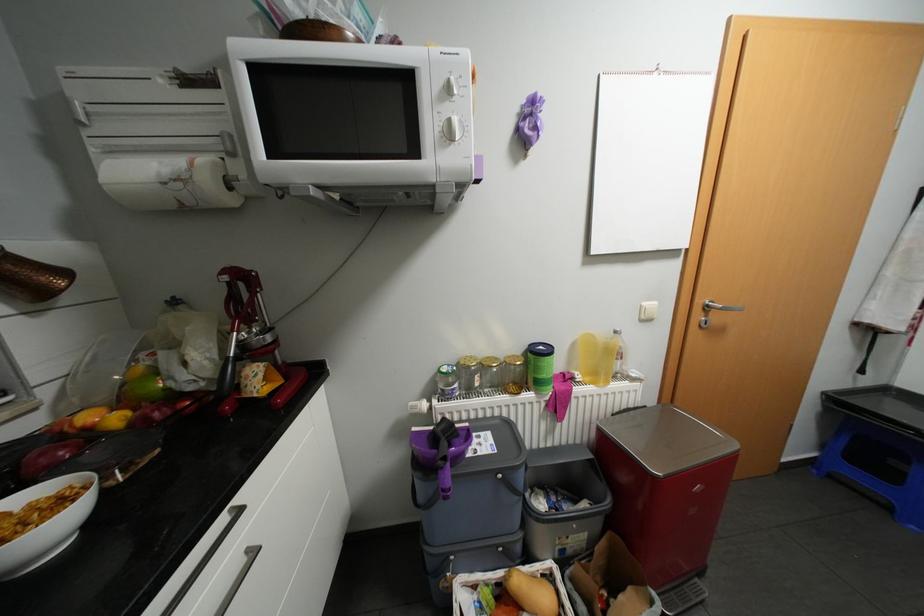
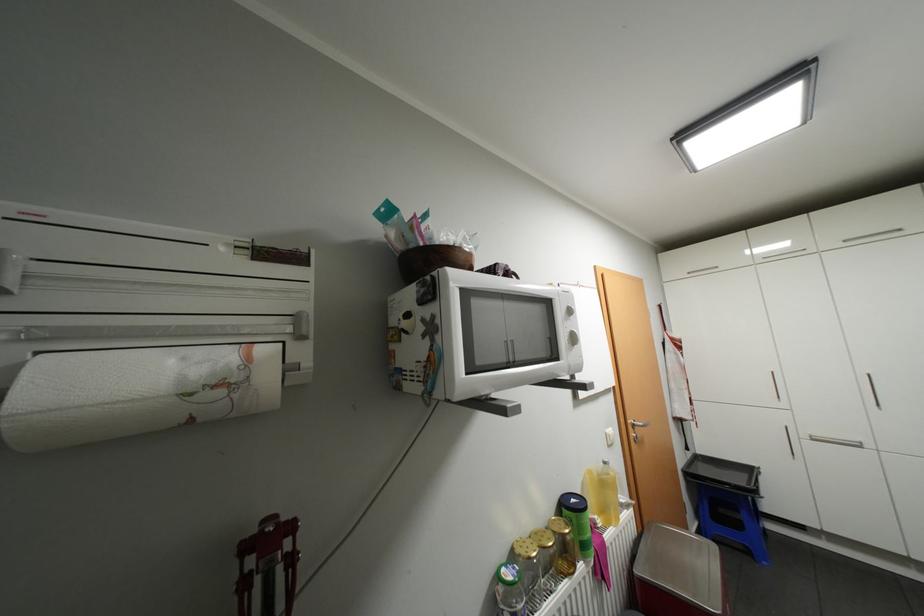
Where in the second image is the point corresponding to the point at 549,346 from the first image?

(580, 499)